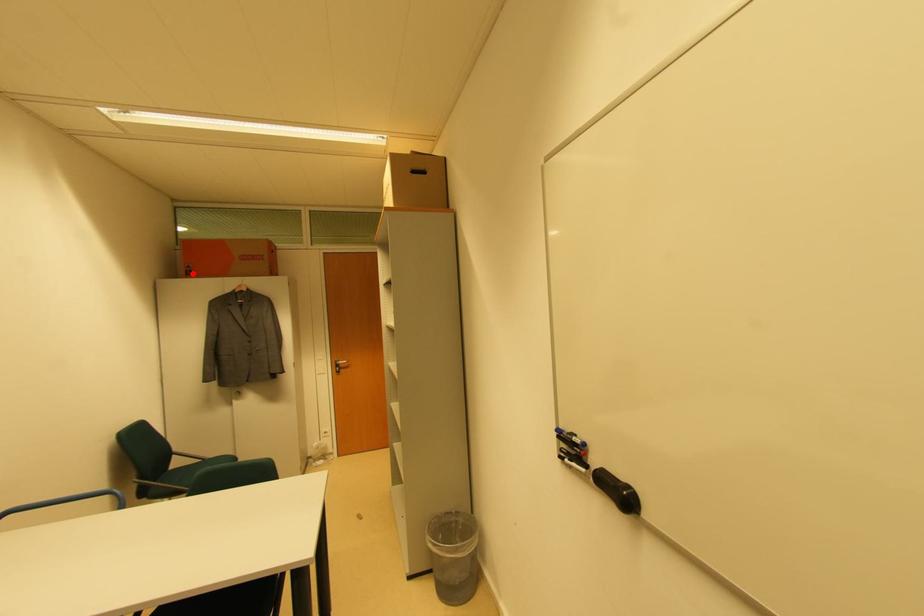
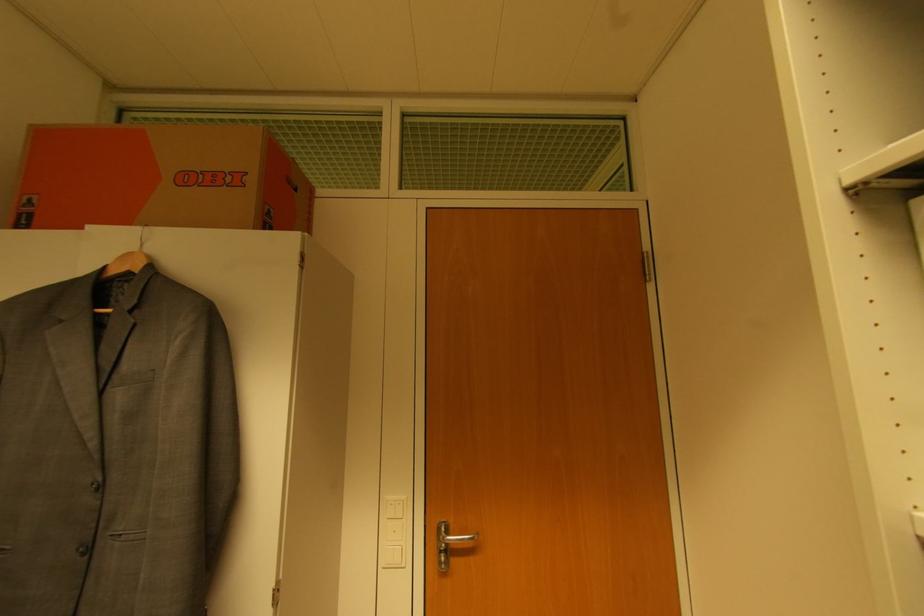
Locate, in the second image, the point that corresponds to the highlighted location in the first image.

(32, 217)